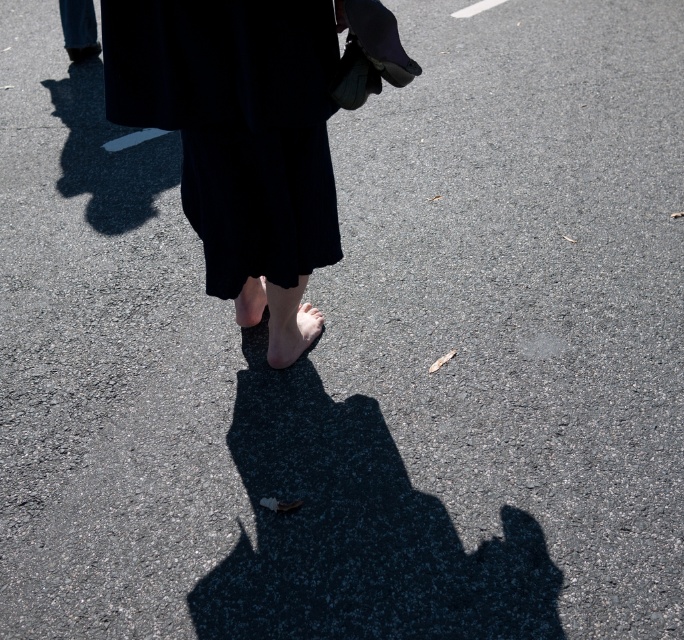
You are a photographer trying to capture the person in the image. You want to ensure the black matte dress at center and the matte skin foot at center are both clearly visible in your shot. Given their sizes, which object should you focus on to ensure both are in frame without cropping?

The black matte dress at center is wider than the matte skin foot at center. To ensure both are in frame without cropping, focus on capturing the wider black matte dress at center first, as it requires more space, and the foot will naturally fit within the same shot.